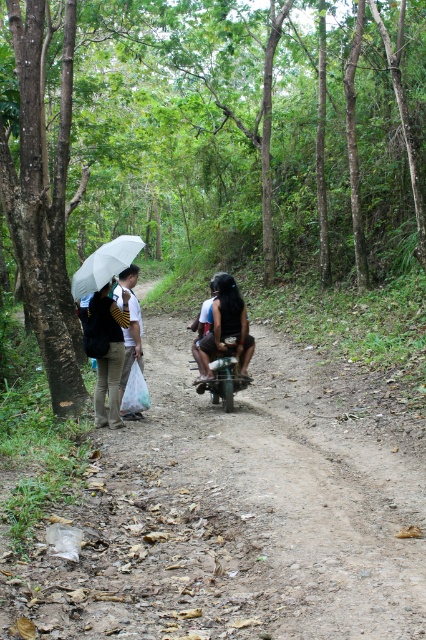
Question: Is dirt road at center above matte black backpack at left?

Choices:
 (A) no
 (B) yes

Answer: (A)

Question: Which point is closer to the camera?

Choices:
 (A) (238, 316)
 (B) (127, 332)

Answer: (B)

Question: Can you confirm if dirt road at center is positioned below dark brown leather backpack at center?

Choices:
 (A) no
 (B) yes

Answer: (B)

Question: Where is dirt road at center located in relation to white matte umbrella at left in the image?

Choices:
 (A) above
 (B) below

Answer: (B)

Question: Which object appears closest to the camera in this image?

Choices:
 (A) white matte umbrella at left
 (B) dirt road at center
 (C) matte black backpack at left
 (D) white matte bag at left

Answer: (B)

Question: Which object is farther from the camera taking this photo?

Choices:
 (A) matte black backpack at left
 (B) white matte bag at left
 (C) dark brown leather backpack at center
 (D) white matte umbrella at left

Answer: (C)